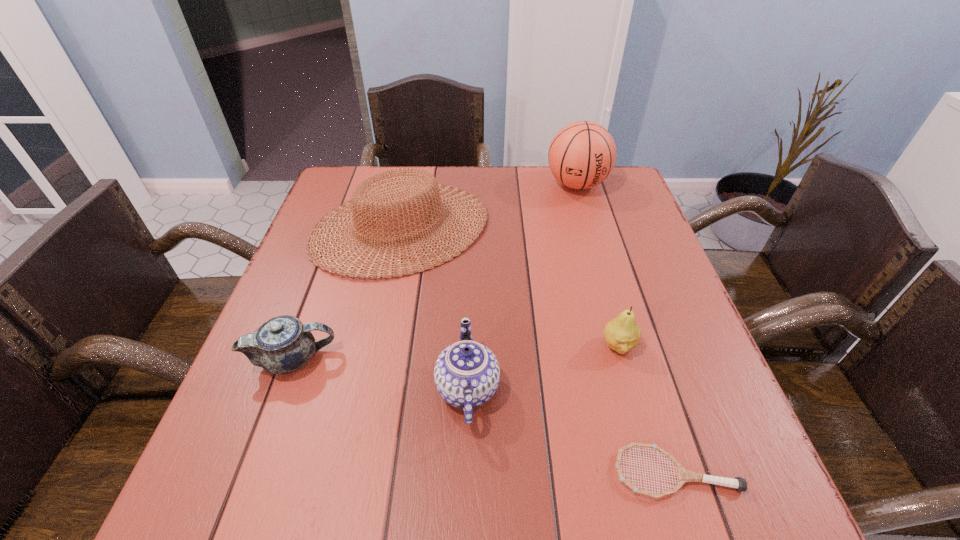
Find the location of a particular element. Image resolution: width=960 pixels, height=540 pixels. free space located 0.130m on the back of the pear is located at coordinates (603, 287).

You are a GUI agent. You are given a task and a screenshot of the screen. Output one action in this format:
    pyautogui.click(x=<x>, y=<y>)
    Task: Click on the vacant space situated 0.380m from the spout of the left chinaware
    This screenshot has width=960, height=540.
    Given the screenshot: What is the action you would take?
    pyautogui.click(x=530, y=359)

The width and height of the screenshot is (960, 540). Identify the location of free space located 0.110m on the left of the shortest object. (545, 472).

You are a GUI agent. You are given a task and a screenshot of the screen. Output one action in this format:
    pyautogui.click(x=<x>, y=<y>)
    Task: Click on the basketball positioned at the far edge
    Image resolution: width=960 pixels, height=540 pixels.
    Given the screenshot: What is the action you would take?
    pyautogui.click(x=582, y=154)

Where is `sunhat located in the far edge section of the desktop`? Image resolution: width=960 pixels, height=540 pixels. sunhat located in the far edge section of the desktop is located at coordinates (367, 203).

Find the location of a particular element. This screenshot has height=540, width=960. object that is at the near edge is located at coordinates (683, 475).

The width and height of the screenshot is (960, 540). I want to click on sunhat that is at the left edge, so click(x=367, y=203).

At what (x,y) coordinates should I click in order to perform the action: click on chinaware that is at the left edge. Please return your answer as a coordinate pair (x, y). The height and width of the screenshot is (540, 960). Looking at the image, I should click on (282, 345).

I want to click on basketball that is at the right edge, so tap(582, 154).

The image size is (960, 540). I want to click on pear present at the right edge, so click(x=622, y=333).